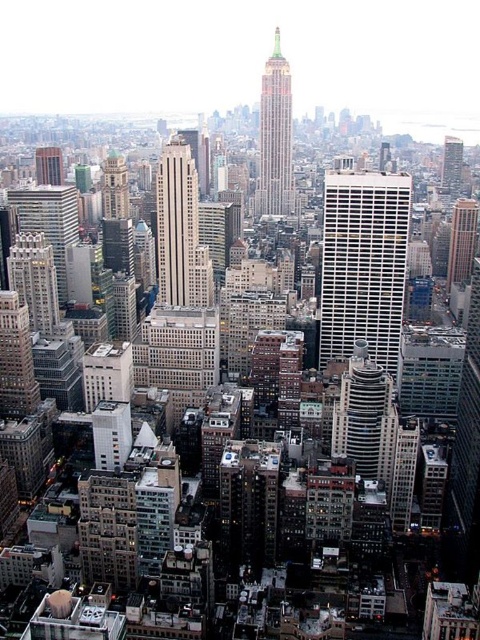
Does matte pink building at center have a larger size compared to brown brick building at right?

Correct, matte pink building at center is larger in size than brown brick building at right.

Which of these two, matte pink building at center or brown brick building at right, stands shorter?

Standing shorter between the two is brown brick building at right.

Locate an element on the screen. The height and width of the screenshot is (640, 480). matte pink building at center is located at coordinates (275, 138).

Looking at this image, which is below, smooth beige skyscraper at center or matte pink building at center?

smooth beige skyscraper at center

The image size is (480, 640). Identify the location of smooth beige skyscraper at center. (177, 225).

Is white textured building at center to the right of smooth beige skyscraper at center from the viewer's perspective?

Yes, white textured building at center is to the right of smooth beige skyscraper at center.

Which of these two, white textured building at center or smooth beige skyscraper at center, stands taller?

white textured building at center

This screenshot has width=480, height=640. Describe the element at coordinates (363, 264) in the screenshot. I see `white textured building at center` at that location.

The image size is (480, 640). In order to click on white textured building at center in this screenshot , I will do `click(363, 264)`.